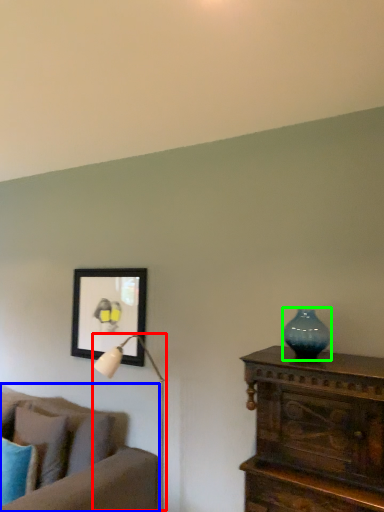
Question: Which object is positioned closest to table lamp (highlighted by a red box)? Select from studio couch (highlighted by a blue box) and vase (highlighted by a green box).

Choices:
 (A) studio couch
 (B) vase

Answer: (A)